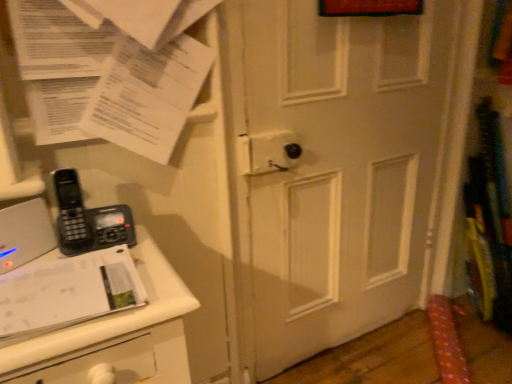
Question: Considering the relative positions of white glossy journal at lower left and white matte door at center in the image provided, is white glossy journal at lower left to the left of white matte door at center from the viewer's perspective?

Choices:
 (A) no
 (B) yes

Answer: (B)

Question: Considering the relative positions of white glossy journal at lower left and white matte door at center in the image provided, is white glossy journal at lower left in front of white matte door at center?

Choices:
 (A) no
 (B) yes

Answer: (B)

Question: Is white glossy journal at lower left to the right of white matte door at center from the viewer's perspective?

Choices:
 (A) yes
 (B) no

Answer: (B)

Question: Does white glossy journal at lower left have a greater height compared to white matte door at center?

Choices:
 (A) no
 (B) yes

Answer: (A)

Question: Does white glossy journal at lower left have a larger size compared to white matte door at center?

Choices:
 (A) yes
 (B) no

Answer: (B)

Question: Can white matte door at center be found inside white glossy journal at lower left?

Choices:
 (A) no
 (B) yes

Answer: (A)

Question: Does black plastic phone at left have a lesser height compared to white matte door at center?

Choices:
 (A) no
 (B) yes

Answer: (B)

Question: Is black plastic phone at left further to camera compared to white matte door at center?

Choices:
 (A) yes
 (B) no

Answer: (B)

Question: Is the surface of black plastic phone at left in direct contact with white matte door at center?

Choices:
 (A) no
 (B) yes

Answer: (A)

Question: Is black plastic phone at left at the left side of white matte door at center?

Choices:
 (A) no
 (B) yes

Answer: (B)

Question: Is black plastic phone at left not close to white matte door at center?

Choices:
 (A) no
 (B) yes

Answer: (A)

Question: Is black plastic phone at left bigger than white matte door at center?

Choices:
 (A) no
 (B) yes

Answer: (A)

Question: From a real-world perspective, is white matte door at center located higher than black plastic phone at left?

Choices:
 (A) no
 (B) yes

Answer: (A)